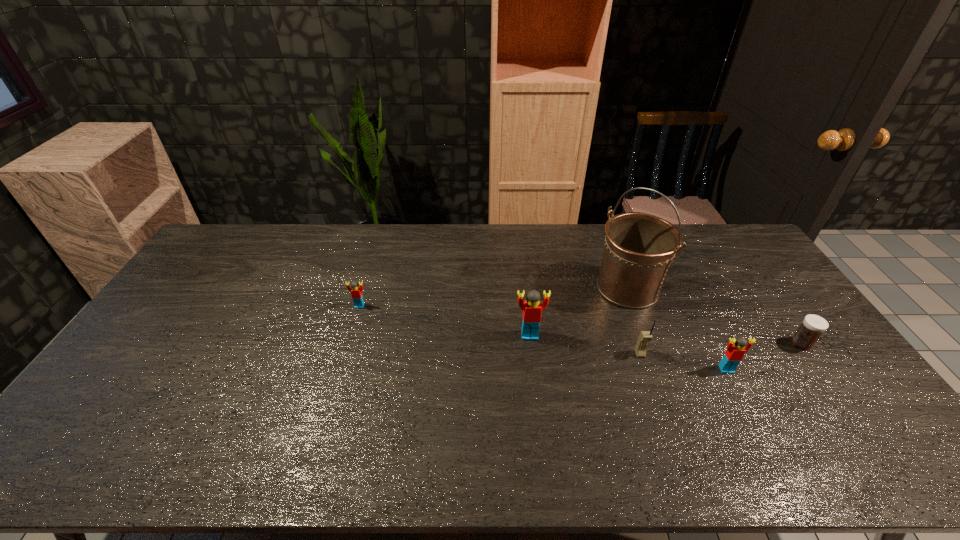
Identify the location of the leftmost object. (356, 291).

Find the location of `the farthest Lego`. the farthest Lego is located at coordinates (356, 291).

Find the location of `the second farthest Lego`. the second farthest Lego is located at coordinates (532, 308).

Locate an element on the screen. This screenshot has width=960, height=540. the tallest Lego is located at coordinates (532, 308).

Image resolution: width=960 pixels, height=540 pixels. Find the location of `the nearest object`. the nearest object is located at coordinates (734, 354).

At what (x,y) coordinates should I click in order to perform the action: click on the second object from right to left. Please return your answer as a coordinate pair (x, y). The height and width of the screenshot is (540, 960). Looking at the image, I should click on (734, 354).

The width and height of the screenshot is (960, 540). In order to click on bucket in this screenshot , I will do `click(639, 248)`.

Identify the location of medicine. (813, 326).

Find the location of a particular element. cellular telephone is located at coordinates (645, 336).

I want to click on vacant space located on the face of the leftmost Lego, so click(x=351, y=335).